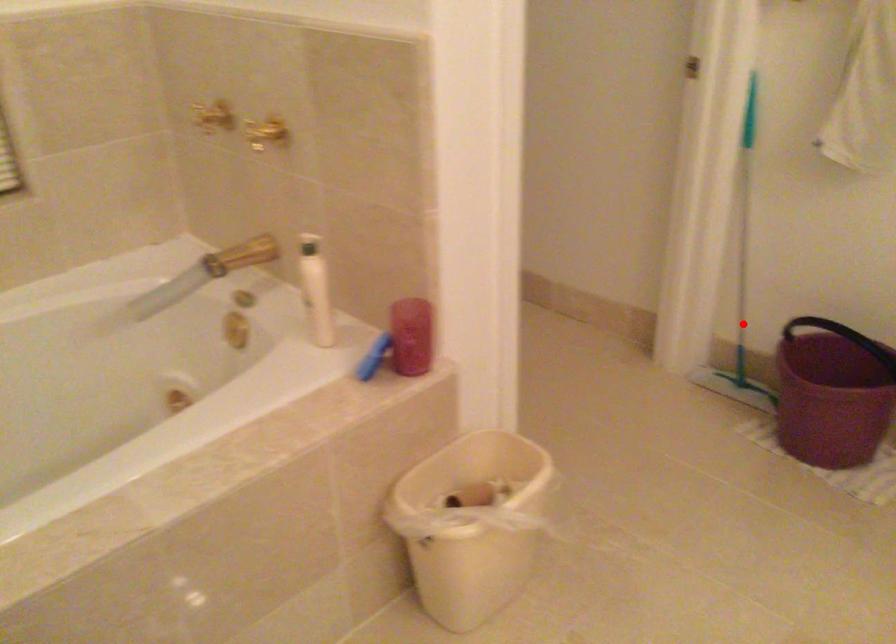
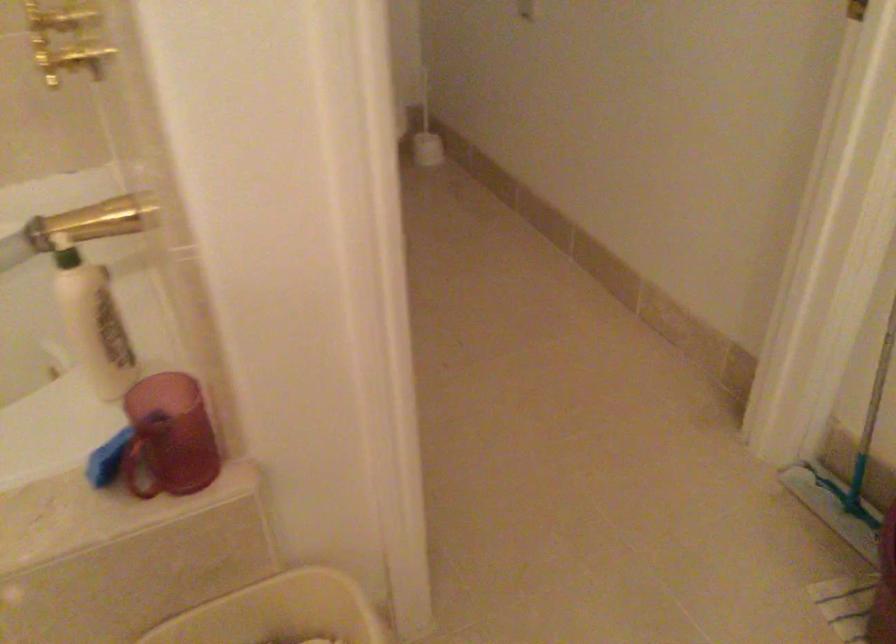
Question: I am providing you with two images of the same scene from different viewpoints. Given a red point in image1, look at the same physical point in image2. Is it:

Choices:
 (A) Closer to the viewpoint
 (B) Farther from the viewpoint

Answer: (A)